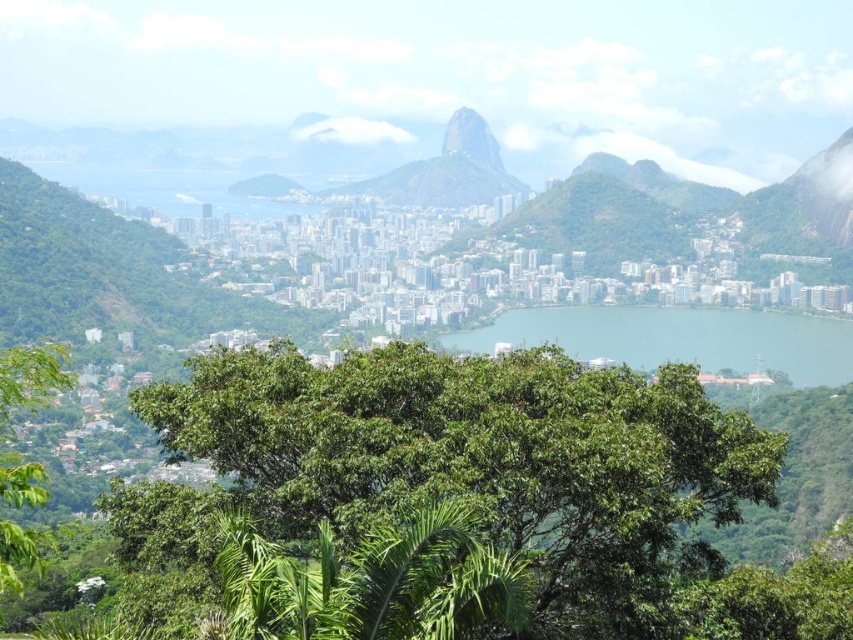
Question: Which point is closer to the camera?

Choices:
 (A) green leafy tree at center
 (B) blue water at center
 (C) green leafy tree at lower left

Answer: (C)

Question: Is blue water at center closer to the viewer compared to green textured mountain at center?

Choices:
 (A) yes
 (B) no

Answer: (A)

Question: Can you confirm if blue water at center is positioned to the left of green leafy tree at lower left?

Choices:
 (A) no
 (B) yes

Answer: (A)

Question: Which object is the farthest from the green leafy tree at center?

Choices:
 (A) green textured mountain at center
 (B) green rock formation at center
 (C) green leafy tree at lower left

Answer: (B)

Question: Which object is positioned farthest from the green rock formation at center?

Choices:
 (A) green textured mountain at center
 (B) green leafy tree at center
 (C) green leafy tree at lower left

Answer: (C)

Question: Is green leafy tree at center below blue water at center?

Choices:
 (A) yes
 (B) no

Answer: (A)